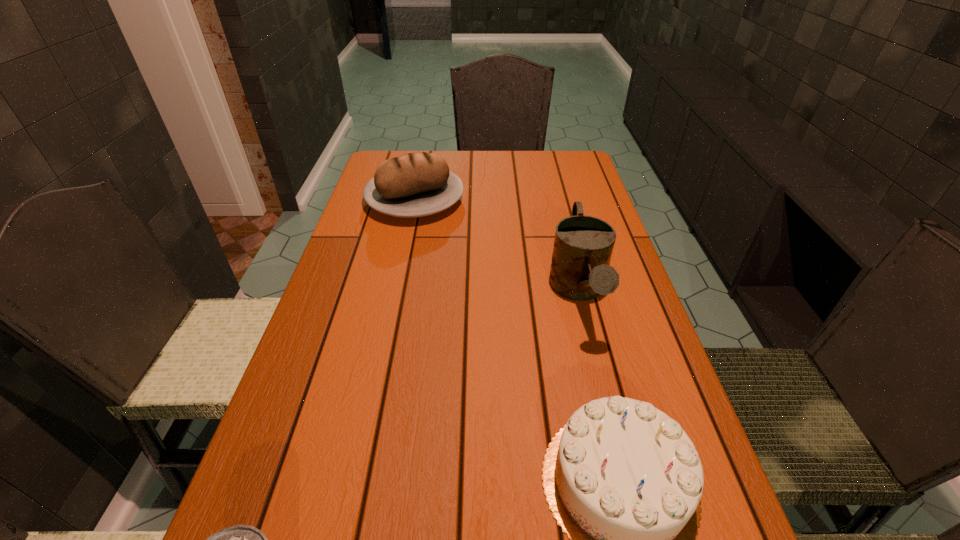
In the image, there is a desktop. Identify the location of vacant space at the left edge. (298, 444).

Find the location of a particular element. The height and width of the screenshot is (540, 960). free space between the tallest object and the bread is located at coordinates (497, 246).

Locate an element on the screen. The width and height of the screenshot is (960, 540). object that is the second closest one to the bread is located at coordinates (624, 481).

Locate which object is the third closest to the birthday cake. Please provide its 2D coordinates. Your answer should be formatted as a tuple, i.e. [(x, y)], where the tuple contains the x and y coordinates of a point satisfying the conditions above.

[(420, 184)]